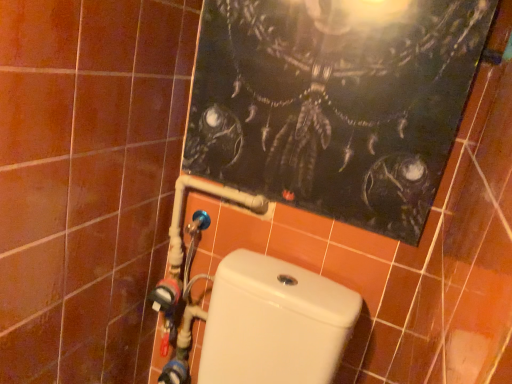
Question: Considering the relative sizes of dark matte poster at upper center and white glossy toilet at lower center in the image provided, is dark matte poster at upper center shorter than white glossy toilet at lower center?

Choices:
 (A) no
 (B) yes

Answer: (A)

Question: From the image's perspective, is dark matte poster at upper center located above white glossy toilet at lower center?

Choices:
 (A) no
 (B) yes

Answer: (B)

Question: From a real-world perspective, is dark matte poster at upper center physically above white glossy toilet at lower center?

Choices:
 (A) no
 (B) yes

Answer: (B)

Question: Does dark matte poster at upper center have a lesser width compared to white glossy toilet at lower center?

Choices:
 (A) no
 (B) yes

Answer: (B)

Question: Can you confirm if dark matte poster at upper center is taller than white glossy toilet at lower center?

Choices:
 (A) no
 (B) yes

Answer: (B)

Question: Does dark matte poster at upper center have a greater width compared to white glossy toilet at lower center?

Choices:
 (A) yes
 (B) no

Answer: (B)

Question: Can you confirm if brown matte tile at left is smaller than dark matte poster at upper center?

Choices:
 (A) no
 (B) yes

Answer: (A)

Question: Is the surface of brown matte tile at left in direct contact with dark matte poster at upper center?

Choices:
 (A) no
 (B) yes

Answer: (A)

Question: Can dark matte poster at upper center be found inside brown matte tile at left?

Choices:
 (A) no
 (B) yes

Answer: (A)

Question: Does brown matte tile at left have a lesser height compared to dark matte poster at upper center?

Choices:
 (A) yes
 (B) no

Answer: (B)

Question: Is brown matte tile at left at the right side of dark matte poster at upper center?

Choices:
 (A) no
 (B) yes

Answer: (A)

Question: Would you say brown matte tile at left is a long distance from dark matte poster at upper center?

Choices:
 (A) yes
 (B) no

Answer: (B)

Question: Is blue plastic water pipe at lower left next to white glossy toilet at lower center and touching it?

Choices:
 (A) yes
 (B) no

Answer: (B)